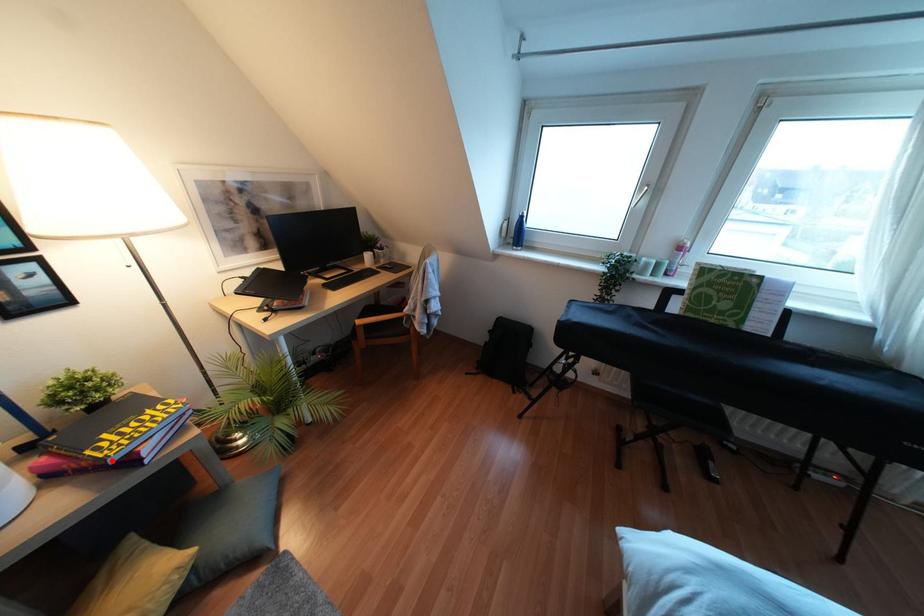
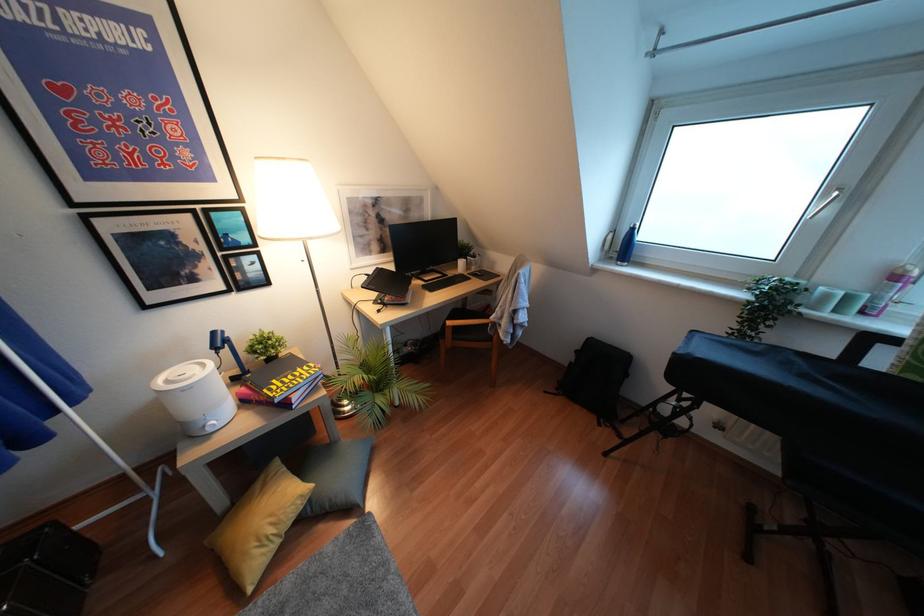
Locate, in the second image, the point that corresponds to the highlighted location in the first image.

(275, 400)